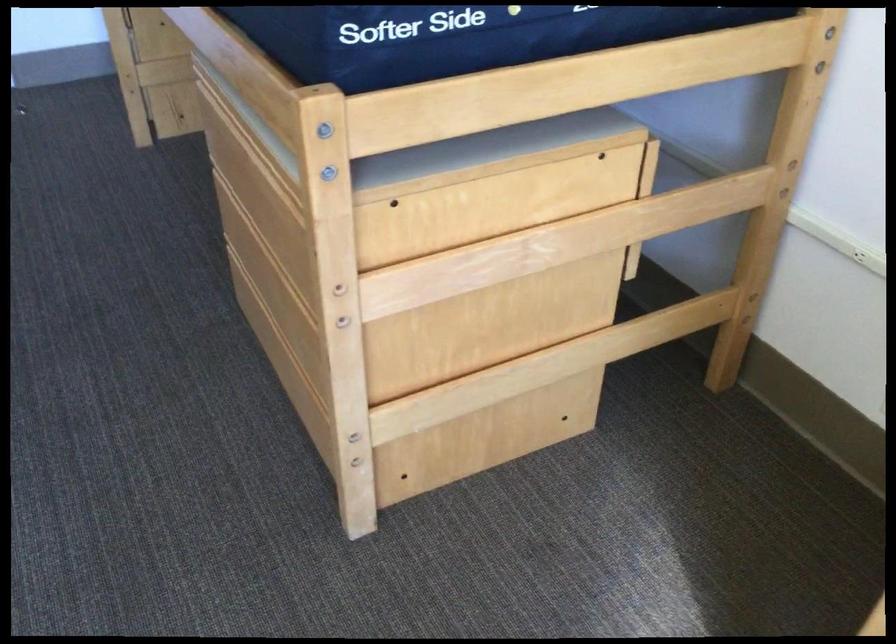
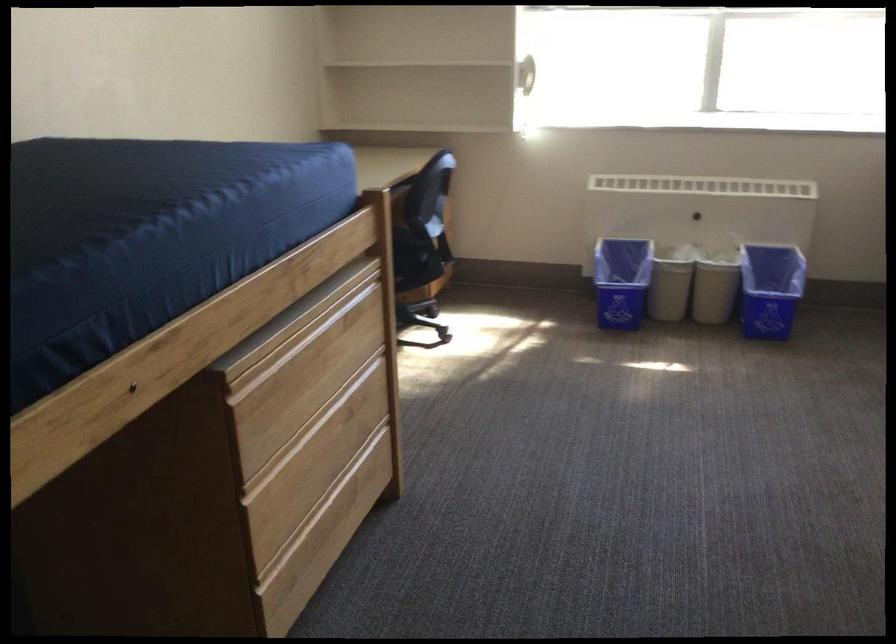
Where in the second image is the point corresponding to the point at 270,252 from the first image?

(307, 431)